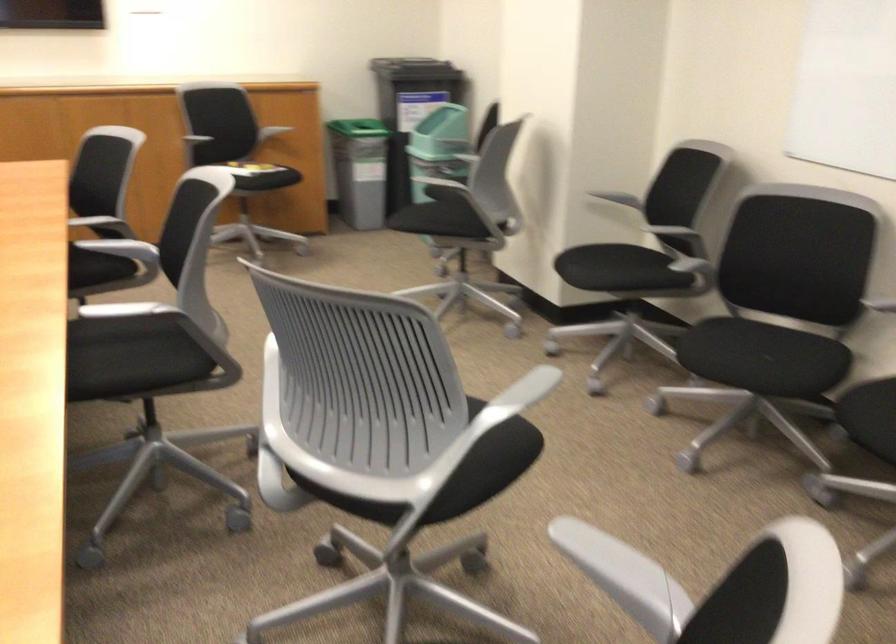
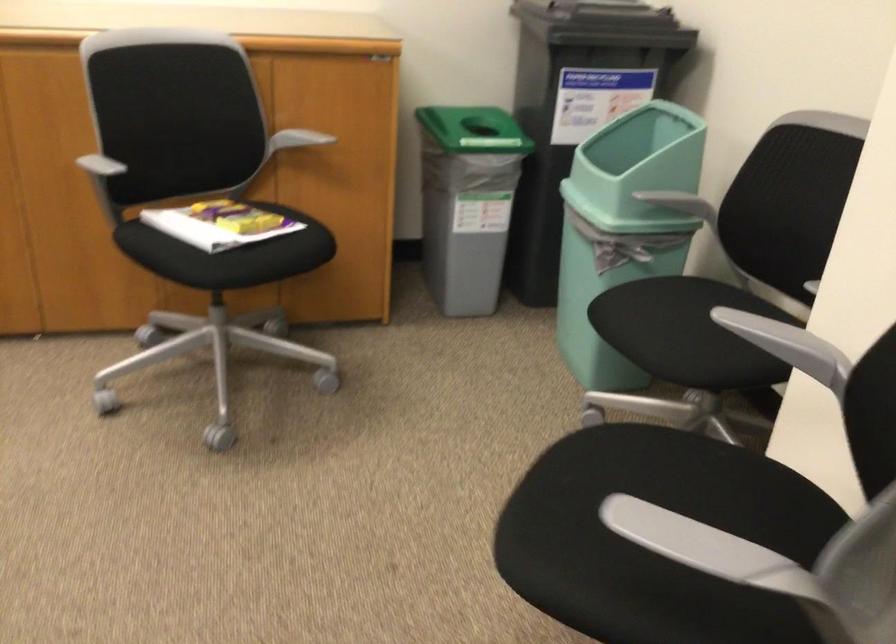
Question: In a continuous first-person perspective shot, in which direction is the camera moving?

Choices:
 (A) Left
 (B) Right
 (C) Forward
 (D) Backward

Answer: (C)